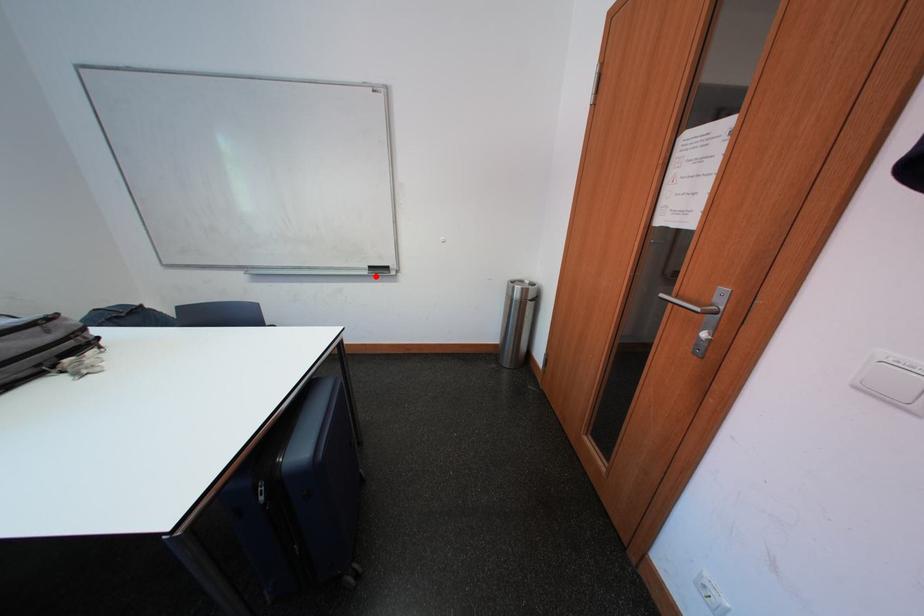
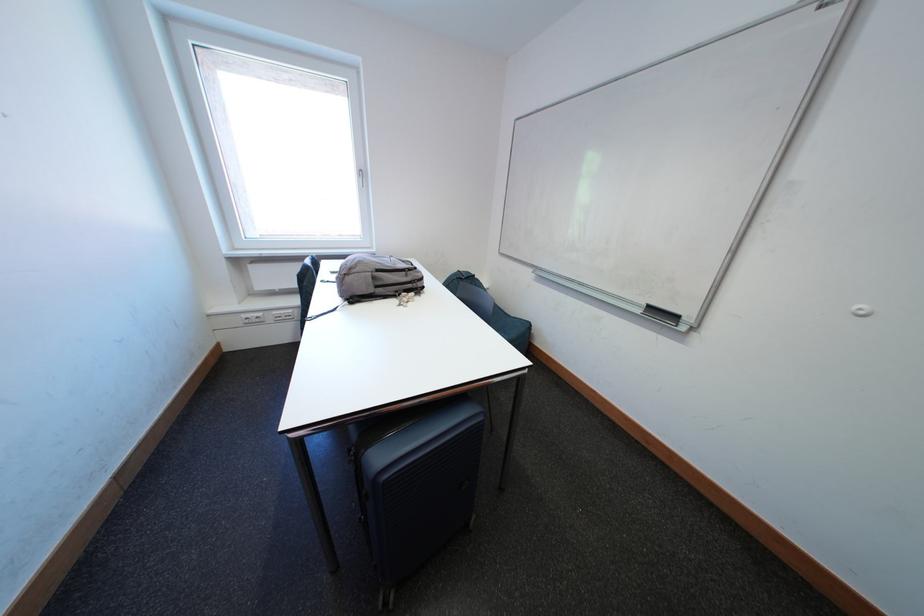
Question: I am providing you with two images of the same scene from different viewpoints. A red point is marked on the first image. Is the red point's position out of view in image 2?

Choices:
 (A) Yes
 (B) No

Answer: (B)